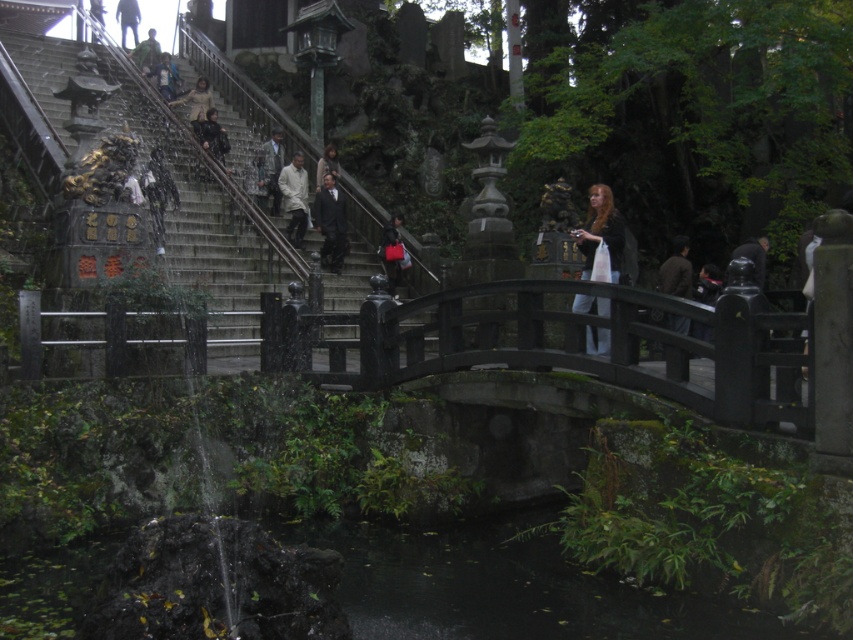
Does light beige fabric coat at center have a greater height compared to smooth black statue at center?

Correct, light beige fabric coat at center is much taller as smooth black statue at center.

Who is more distant from viewer, (299, 152) or (735, 248)?

Point (735, 248)

Identify the location of light beige fabric coat at center. This screenshot has height=640, width=853. (294, 196).

How distant is light brown leather jacket at upper center from camouflage uniform at upper center?

The distance of light brown leather jacket at upper center from camouflage uniform at upper center is 2.07 meters.

Is light brown leather jacket at upper center taller than camouflage uniform at upper center?

No, light brown leather jacket at upper center is not taller than camouflage uniform at upper center.

Is point (167, 84) more distant than point (143, 54)?

No, it is not.

You are a GUI agent. You are given a task and a screenshot of the screen. Output one action in this format:
    pyautogui.click(x=<x>, y=<y>)
    Task: Click on the light brown leather jacket at upper center
    
    Given the screenshot: What is the action you would take?
    pyautogui.click(x=166, y=76)

Does matte brown statue at upper center have a larger size compared to camouflage uniform at upper center?

Actually, matte brown statue at upper center might be smaller than camouflage uniform at upper center.

Measure the distance between matte brown statue at upper center and camouflage uniform at upper center.

matte brown statue at upper center is 7.75 meters away from camouflage uniform at upper center.

Between point (195, 104) and point (143, 56), which one is positioned in front?

Point (195, 104) is in front.

You are a GUI agent. You are given a task and a screenshot of the screen. Output one action in this format:
    pyautogui.click(x=<x>, y=<y>)
    Task: Click on the matte brown statue at upper center
    This screenshot has height=640, width=853.
    Given the screenshot: What is the action you would take?
    pyautogui.click(x=196, y=100)